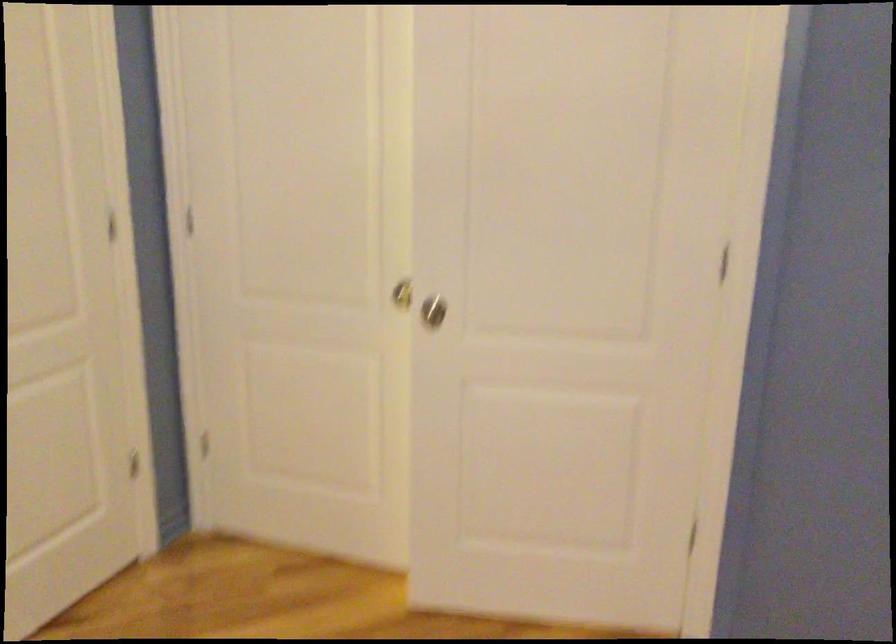
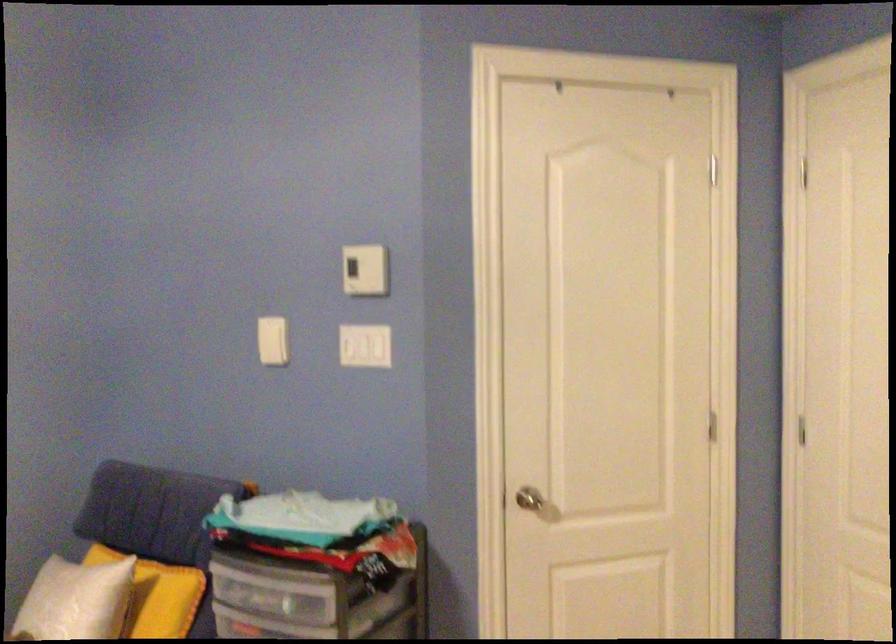
Question: How did the camera likely rotate?

Choices:
 (A) Left
 (B) Right
 (C) Up
 (D) Down

Answer: (A)